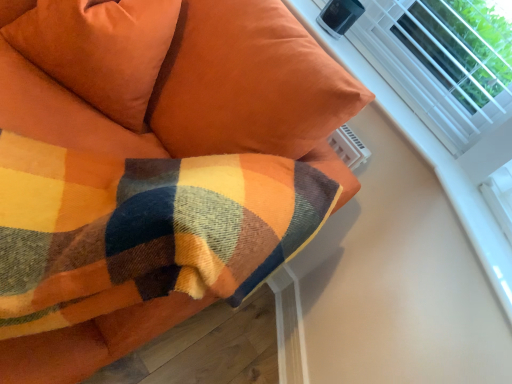
Question: Is plaid wool blanket at upper left at the back of suede-like orange pillow at upper left?

Choices:
 (A) no
 (B) yes

Answer: (B)

Question: From the image's perspective, is suede-like orange pillow at upper left beneath plaid wool blanket at upper left?

Choices:
 (A) no
 (B) yes

Answer: (A)

Question: Is plaid wool blanket at upper left located within suede-like orange pillow at upper left?

Choices:
 (A) yes
 (B) no

Answer: (B)

Question: Is suede-like orange pillow at upper left facing towards plaid wool blanket at upper left?

Choices:
 (A) yes
 (B) no

Answer: (A)

Question: Is suede-like orange pillow at upper left at the left side of plaid wool blanket at upper left?

Choices:
 (A) yes
 (B) no

Answer: (B)

Question: Is suede-like orange pillow at upper left at the right side of plaid wool blanket at upper left?

Choices:
 (A) yes
 (B) no

Answer: (A)

Question: Is suede-like orange pillow at upper left to the left of white plastic radiator at upper right from the viewer's perspective?

Choices:
 (A) no
 (B) yes

Answer: (B)

Question: From the image's perspective, is suede-like orange pillow at upper left below white plastic radiator at upper right?

Choices:
 (A) no
 (B) yes

Answer: (A)

Question: Is the position of suede-like orange pillow at upper left less distant than that of white plastic radiator at upper right?

Choices:
 (A) no
 (B) yes

Answer: (B)

Question: Is suede-like orange pillow at upper left far away from white plastic radiator at upper right?

Choices:
 (A) no
 (B) yes

Answer: (A)

Question: Considering the relative positions of suede-like orange pillow at upper left and white plastic radiator at upper right in the image provided, is suede-like orange pillow at upper left to the right of white plastic radiator at upper right from the viewer's perspective?

Choices:
 (A) no
 (B) yes

Answer: (A)

Question: Is suede-like orange pillow at upper left looking in the opposite direction of white plastic radiator at upper right?

Choices:
 (A) yes
 (B) no

Answer: (B)

Question: Is plaid wool blanket at upper left further to camera compared to suede-like orange pillow at upper left?

Choices:
 (A) no
 (B) yes

Answer: (A)